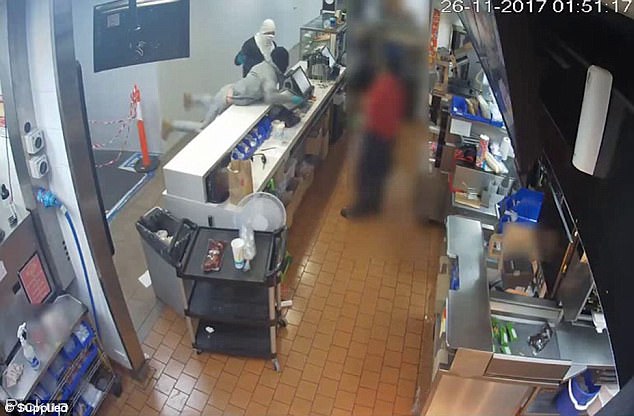
At what (x,y) coordinates should I click in order to perform the action: click on floor. Please return your answer as a coordinate pair (x, y). Looking at the image, I should click on (343, 372).